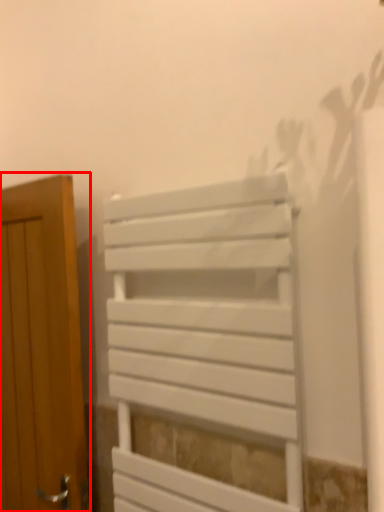
Question: Observing the image, what is the correct spatial positioning of door (annotated by the red box) in reference to furniture?

Choices:
 (A) left
 (B) right

Answer: (A)